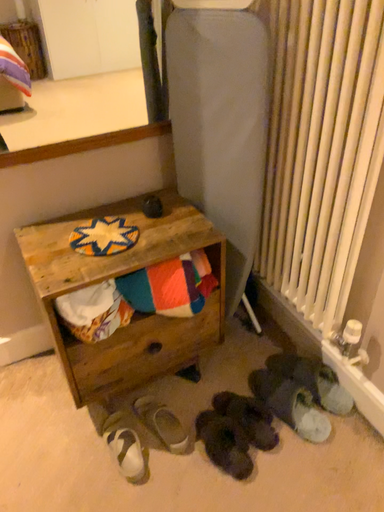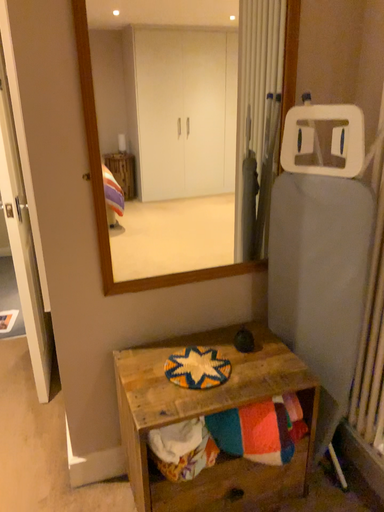
Question: Which way did the camera rotate in the video?

Choices:
 (A) rotated downward
 (B) rotated upward

Answer: (B)